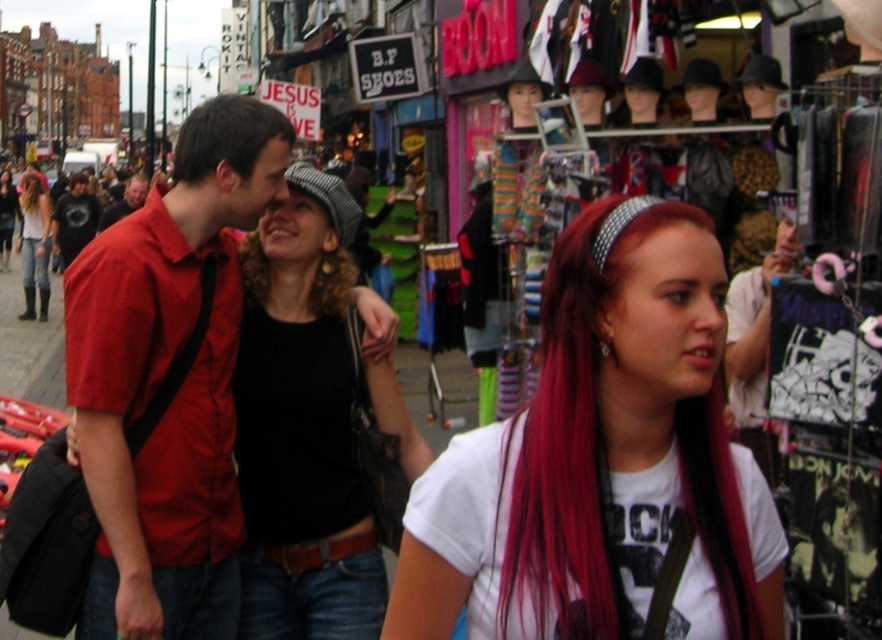
You are a photographer trying to capture a candid shot of the matte red shirt at center and the brown matte hair at upper left. Which object should you focus on first if you want to capture both in one frame without moving the camera?

You should focus on the matte red shirt at center first because it is located below the brown matte hair at upper left, so adjusting the camera angle to include both would require framing from the bottom up.

You are standing at the point with coordinates point (214, 128) and want to walk towards the point with coordinates point (355, 268). Based on the scene description, will you have to move forward or backward to reach your destination?

You will have to move forward to reach point (355, 268) because point (214, 128) is in front of it according to the spatial arrangement described.